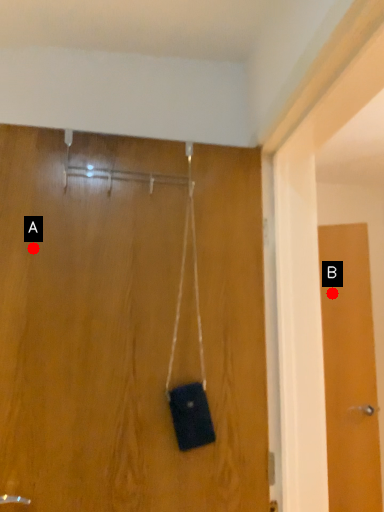
Question: Two points are circled on the image, labeled by A and B beside each circle. Which point is farther from the camera taking this photo?

Choices:
 (A) A is further
 (B) B is further

Answer: (B)